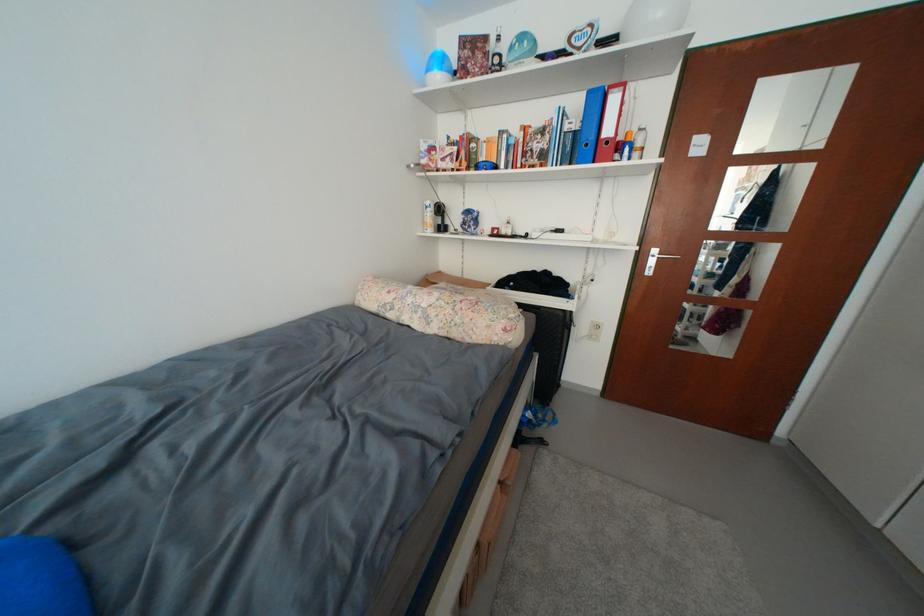
Find the location of a particular element. The width and height of the screenshot is (924, 616). yellow spray can is located at coordinates (626, 146).